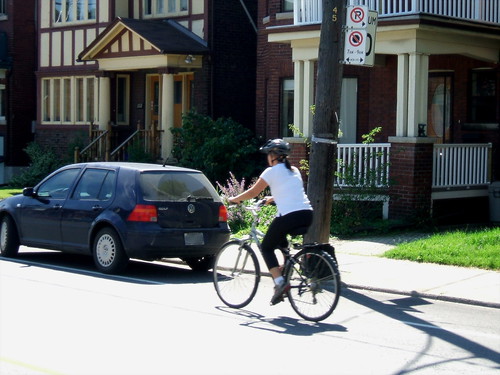
At what (x,y) coordinates should I click in order to perform the action: click on left mirror. Please return your answer as a coordinate pair (x, y). The height and width of the screenshot is (375, 500). Looking at the image, I should click on (28, 192).